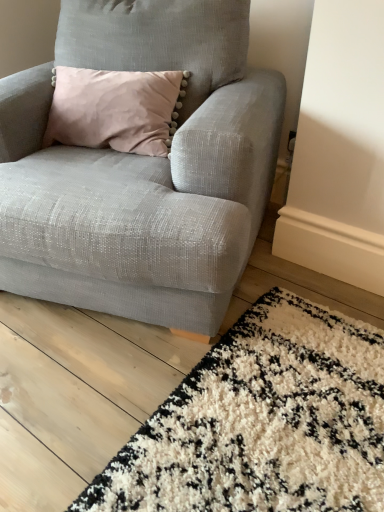
You are a GUI agent. You are given a task and a screenshot of the screen. Output one action in this format:
    pyautogui.click(x=<x>, y=<y>)
    Task: Click on the free spot in front of textured gray armchair at center
    The width and height of the screenshot is (384, 512).
    Given the screenshot: What is the action you would take?
    pyautogui.click(x=163, y=410)